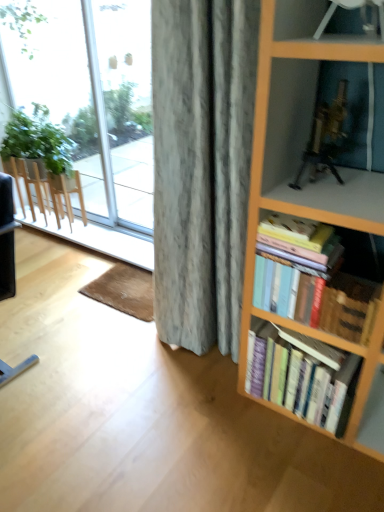
What do you see at coordinates (123, 105) in the screenshot? I see `transparent glass door at left` at bounding box center [123, 105].

The image size is (384, 512). Find the location of `transparent glass window at upper left`. transparent glass window at upper left is located at coordinates (93, 94).

Measure the distance between black leather chair at lower left and camera.

black leather chair at lower left is 2.32 meters away from camera.

What is the approximate width of hardcover books at right, the 1th book when ordered from bottom to top?

hardcover books at right, the 1th book when ordered from bottom to top, is 11.10 inches in width.

What is the approximate height of hardcover books at right, acting as the 2th book starting from the top?

hardcover books at right, acting as the 2th book starting from the top, is 14.08 inches tall.

Identify the location of transparent glass door at left. (123, 105).

I want to click on glass door behind the black leather chair at lower left, so click(x=123, y=105).

In terms of height, does transparent glass door at left look taller or shorter compared to black leather chair at lower left?

Considering their sizes, transparent glass door at left has more height than black leather chair at lower left.

Which of these two, transparent glass door at left or black leather chair at lower left, is thinner?

Thinner between the two is transparent glass door at left.

Could you tell me if transparent glass door at left is facing black leather chair at lower left?

Yes.

Is transparent glass door at left completely or partially inside transparent glass window at upper left?

No, transparent glass door at left is located outside of transparent glass window at upper left.

Is transparent glass window at upper left wider than transparent glass door at left?

No, transparent glass window at upper left is not wider than transparent glass door at left.

From the image's perspective, does transparent glass window at upper left appear lower than transparent glass door at left?

No, from the image's perspective, transparent glass window at upper left is not beneath transparent glass door at left.

Considering the sizes of transparent glass window at upper left and transparent glass door at left in the image, is transparent glass window at upper left bigger or smaller than transparent glass door at left?

In the image, transparent glass window at upper left appears to be smaller than transparent glass door at left.

Based on the photo, is transparent glass door at left behind hardcover books at right, which is the 2th book from bottom to top?

Yes, transparent glass door at left is further from the camera.

Image resolution: width=384 pixels, height=512 pixels. Find the location of `glass door above the hardcover books at right, the 1th book when ordered from top to bottom (from a real-world perspective)`. glass door above the hardcover books at right, the 1th book when ordered from top to bottom (from a real-world perspective) is located at coordinates (123, 105).

Is transparent glass door at left shorter than hardcover books at right, which is the 2th book from bottom to top?

No.

Are transparent glass door at left and hardcover books at right, which is the 2th book from bottom to top, located far from each other?

transparent glass door at left is far away from hardcover books at right, which is the 2th book from bottom to top.

Is transparent glass window at upper left to the left of metallic gold tripod at upper right from the viewer's perspective?

Yes.

Considering the points (136, 145) and (324, 136), which point is in front, point (136, 145) or point (324, 136)?

The point (324, 136) is in front.

Is transparent glass window at upper left outside of metallic gold tripod at upper right?

That's correct, transparent glass window at upper left is outside of metallic gold tripod at upper right.

Which object is closer to the camera, transparent glass window at upper left or metallic gold tripod at upper right?

metallic gold tripod at upper right.

What's the angular difference between black leather chair at lower left and hardcover books at right, the 1th book when ordered from top to bottom,'s facing directions?

The angular difference between black leather chair at lower left and hardcover books at right, the 1th book when ordered from top to bottom, is 0.545 degrees.

Is black leather chair at lower left to the right of hardcover books at right, which is the 2th book from bottom to top, from the viewer's perspective?

No, black leather chair at lower left is not to the right of hardcover books at right, which is the 2th book from bottom to top.

Is black leather chair at lower left directly adjacent to hardcover books at right, the 1th book when ordered from top to bottom?

No, black leather chair at lower left is not next to hardcover books at right, the 1th book when ordered from top to bottom.

From the image's perspective, between black leather chair at lower left and hardcover books at right, the 1th book when ordered from top to bottom, who is located below?

black leather chair at lower left appears lower in the image.

Could you tell me if black leather chair at lower left is turned towards hardcover books at right, acting as the 2th book starting from the top?

No, black leather chair at lower left is not facing towards hardcover books at right, acting as the 2th book starting from the top.

Which of these two, black leather chair at lower left or hardcover books at right, the 1th book when ordered from bottom to top, stands shorter?

Standing shorter between the two is hardcover books at right, the 1th book when ordered from bottom to top.

Can you confirm if black leather chair at lower left is bigger than hardcover books at right, acting as the 2th book starting from the top?

Correct, black leather chair at lower left is larger in size than hardcover books at right, acting as the 2th book starting from the top.

Is hardcover books at right, the 1th book when ordered from bottom to top, inside black leather chair at lower left?

Actually, hardcover books at right, the 1th book when ordered from bottom to top, is outside black leather chair at lower left.

How distant is hardcover books at right, the 1th book when ordered from top to bottom, from transparent glass window at upper left?

2.29 meters.

Considering the relative sizes of hardcover books at right, the 1th book when ordered from top to bottom, and transparent glass window at upper left in the image provided, is hardcover books at right, the 1th book when ordered from top to bottom, wider than transparent glass window at upper left?

Indeed, hardcover books at right, the 1th book when ordered from top to bottom, has a greater width compared to transparent glass window at upper left.

Is hardcover books at right, the 1th book when ordered from top to bottom, closer to the viewer compared to transparent glass window at upper left?

Yes, hardcover books at right, the 1th book when ordered from top to bottom, is closer to the camera.

Where is `glass door above the black leather chair at lower left (from a real-world perspective)`? The width and height of the screenshot is (384, 512). glass door above the black leather chair at lower left (from a real-world perspective) is located at coordinates (123, 105).

Image resolution: width=384 pixels, height=512 pixels. In order to click on glass door that appears below the transparent glass window at upper left (from a real-world perspective) in this screenshot , I will do `click(123, 105)`.

Which object lies further to the anchor point black leather chair at lower left, hardcover books at right, acting as the 2th book starting from the top, or hardcover books at right, which is the 2th book from bottom to top?

Among the two, hardcover books at right, which is the 2th book from bottom to top, is located further to black leather chair at lower left.

Based on their spatial positions, is hardcover books at right, which is the 2th book from bottom to top, or hardcover books at right, acting as the 2th book starting from the top, further from transparent glass door at left?

hardcover books at right, which is the 2th book from bottom to top.

Which object lies further to the anchor point transparent glass window at upper left, black leather chair at lower left or hardcover books at right, acting as the 2th book starting from the top?

hardcover books at right, acting as the 2th book starting from the top, lies further to transparent glass window at upper left than the other object.

Looking at the image, which one is located closer to hardcover books at right, the 1th book when ordered from top to bottom, hardcover books at right, the 1th book when ordered from bottom to top, or transparent glass door at left?

hardcover books at right, the 1th book when ordered from bottom to top, is closer to hardcover books at right, the 1th book when ordered from top to bottom.

Looking at the image, which one is located further to transparent glass door at left, metallic gold tripod at upper right or hardcover books at right, acting as the 2th book starting from the top?

Based on the image, metallic gold tripod at upper right appears to be further to transparent glass door at left.

When comparing their distances from hardcover books at right, which is the 2th book from bottom to top, does metallic gold tripod at upper right or transparent glass door at left seem closer?

metallic gold tripod at upper right lies closer to hardcover books at right, which is the 2th book from bottom to top, than the other object.

Considering their positions, is transparent glass window at upper left positioned further to metallic gold tripod at upper right than transparent glass door at left?

transparent glass window at upper left is further to metallic gold tripod at upper right.

From the image, which object appears to be farther from metallic gold tripod at upper right, transparent glass door at left or hardcover books at right, which is the 2th book from bottom to top?

The object further to metallic gold tripod at upper right is transparent glass door at left.

The width and height of the screenshot is (384, 512). In order to click on glass door between transparent glass window at upper left and hardcover books at right, the 1th book when ordered from bottom to top, from top to bottom in this screenshot , I will do `click(123, 105)`.

Locate an element on the screen. glass door between black leather chair at lower left and hardcover books at right, the 1th book when ordered from bottom to top, in the horizontal direction is located at coordinates (123, 105).

At what (x,y) coordinates should I click in order to perform the action: click on chair situated between transparent glass window at upper left and metallic gold tripod at upper right from left to right. Please return your answer as a coordinate pair (x, y). Image resolution: width=384 pixels, height=512 pixels. Looking at the image, I should click on (7, 239).

Identify the location of glass door between transparent glass window at upper left and metallic gold tripod at upper right. (123, 105).